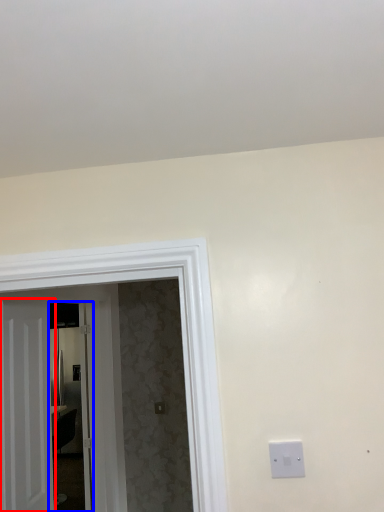
Question: Which object appears farthest to the camera in this image, door (highlighted by a red box) or glass door (highlighted by a blue box)?

Choices:
 (A) door
 (B) glass door

Answer: (B)